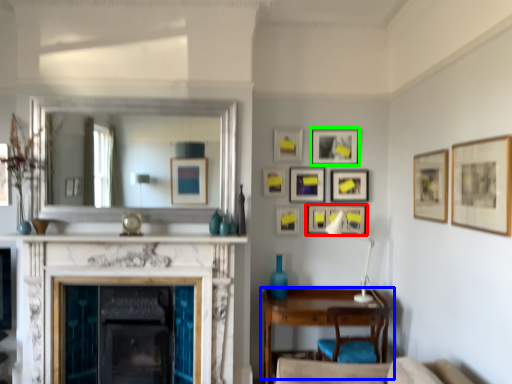
Question: Considering the real-world distances, which object is closest to picture frame (highlighted by a red box)? table (highlighted by a blue box) or picture frame (highlighted by a green box).

Choices:
 (A) table
 (B) picture frame

Answer: (B)